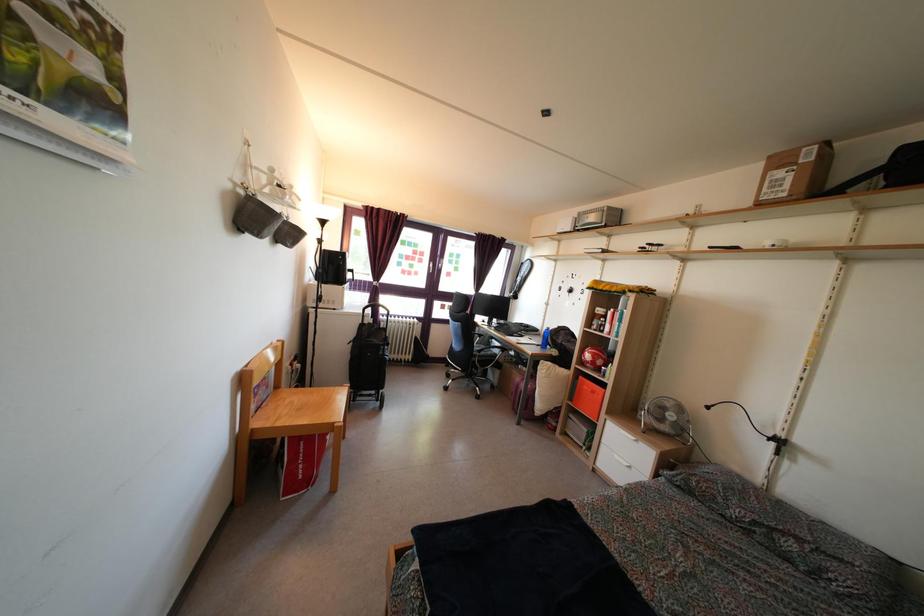
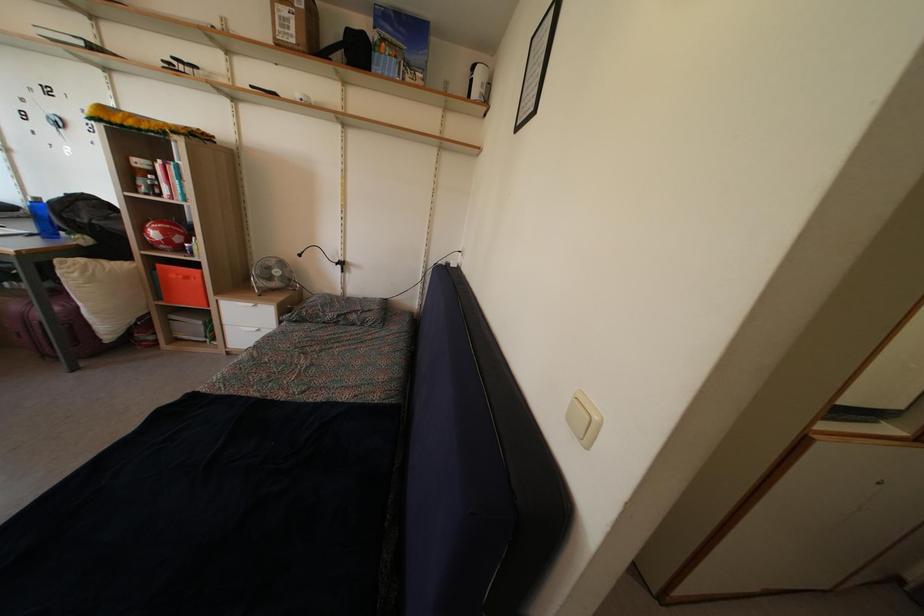
Where in the second image is the point corresponding to [787,203] from the first image?

(296, 50)